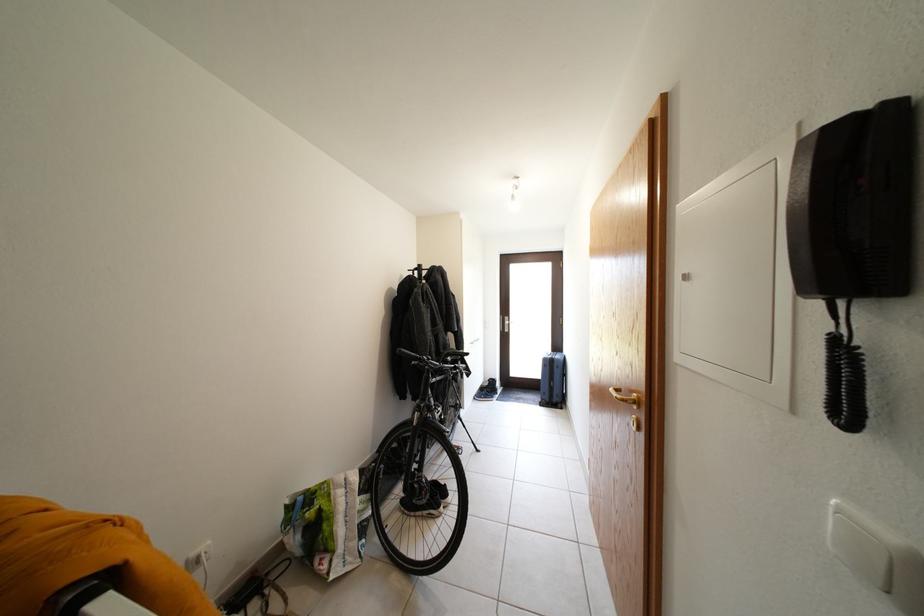
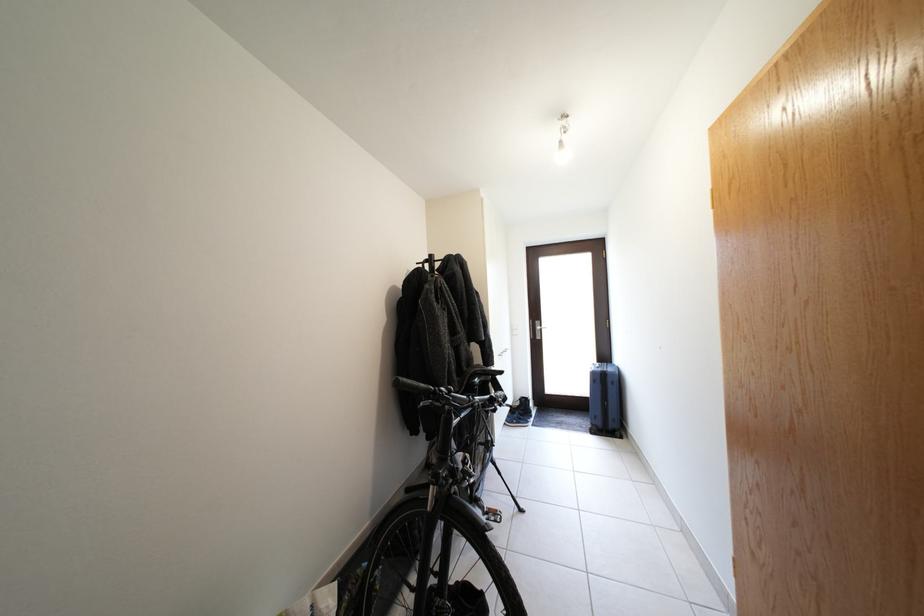
Question: How did the camera likely rotate?

Choices:
 (A) Left
 (B) Right
 (C) Up
 (D) Down

Answer: (A)